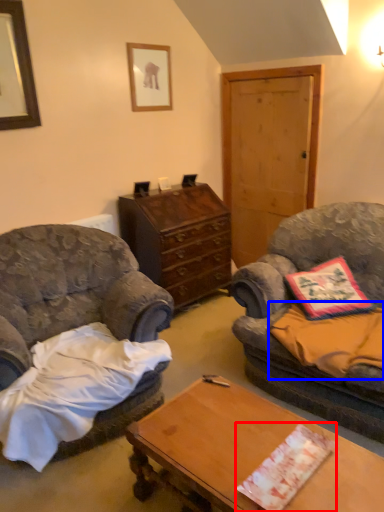
Question: Which of the following is the closest to the observer, sheet (highlighted by a red box) or sheet (highlighted by a blue box)?

Choices:
 (A) sheet
 (B) sheet

Answer: (A)